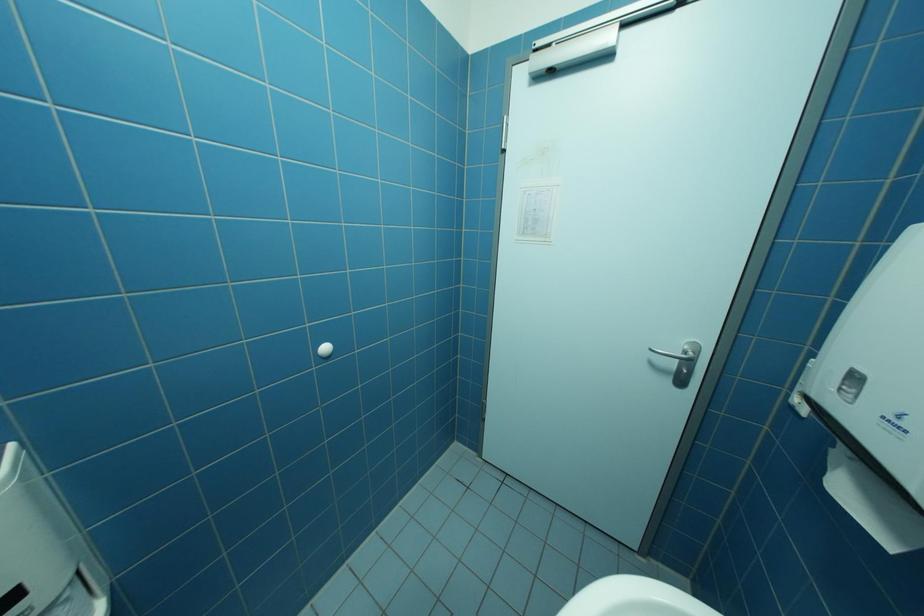
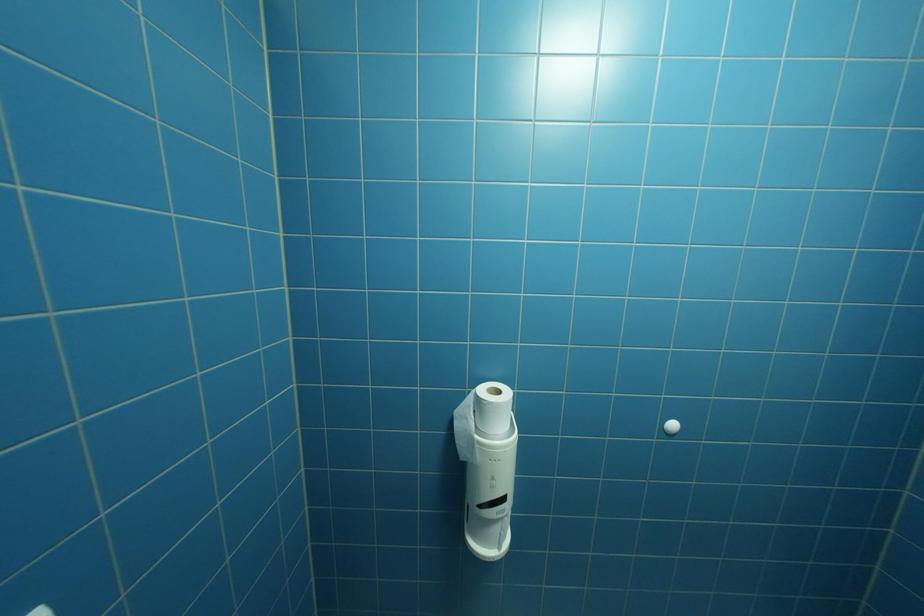
Question: How did the camera likely rotate?

Choices:
 (A) Left
 (B) Right
 (C) Up
 (D) Down

Answer: (A)